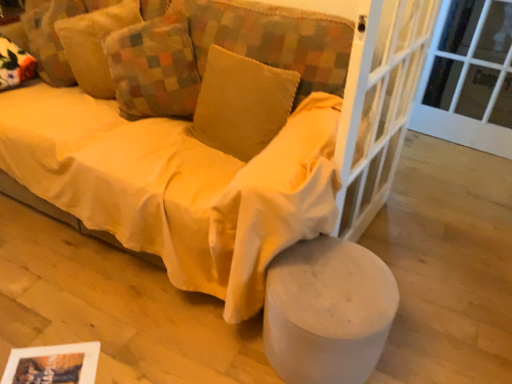
Image resolution: width=512 pixels, height=384 pixels. I want to click on free space to the left of white fabric stool at lower right, so click(x=206, y=342).